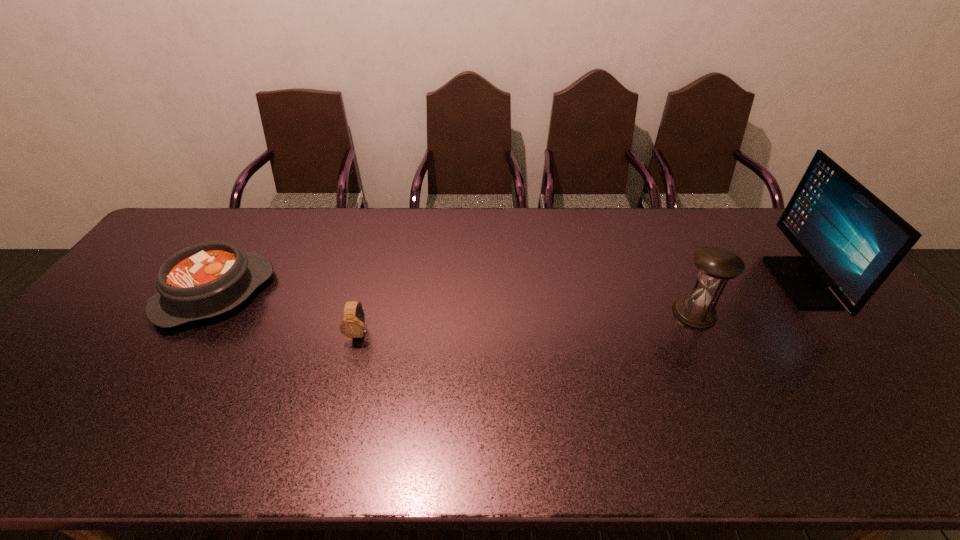
Identify which object is the third closest to the third object from left to right. Please provide its 2D coordinates. Your answer should be formatted as a tuple, i.e. [(x, y)], where the tuple contains the x and y coordinates of a point satisfying the conditions above.

[(207, 279)]

Identify which object is the nearest to the monitor. Please provide its 2D coordinates. Your answer should be formatted as a tuple, i.e. [(x, y)], where the tuple contains the x and y coordinates of a point satisfying the conditions above.

[(716, 265)]

Where is `free space that satisfies the following two spatial constraints: 1. on the screen side of the tallest object; 2. on the front side of the third object from left to right`? The image size is (960, 540). free space that satisfies the following two spatial constraints: 1. on the screen side of the tallest object; 2. on the front side of the third object from left to right is located at coordinates (826, 313).

Where is `vacant point that satisfies the following two spatial constraints: 1. on the screen side of the rightmost object; 2. on the front side of the second tallest object`? The width and height of the screenshot is (960, 540). vacant point that satisfies the following two spatial constraints: 1. on the screen side of the rightmost object; 2. on the front side of the second tallest object is located at coordinates (826, 313).